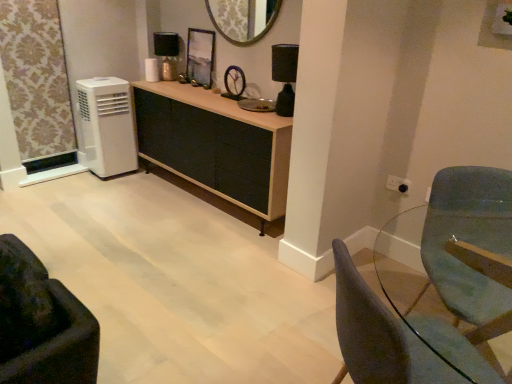
Question: Considering the relative sizes of metallic gold lamp at upper center, positioned as the second lamp in right-to-left order, and black matte lamp at upper right, which is the second lamp from back to front, in the image provided, is metallic gold lamp at upper center, positioned as the second lamp in right-to-left order, thinner than black matte lamp at upper right, which is the second lamp from back to front,?

Choices:
 (A) yes
 (B) no

Answer: (A)

Question: From a real-world perspective, is metallic gold lamp at upper center, the 2th lamp in the front-to-back sequence, physically below black matte lamp at upper right, which is the 2th lamp from left to right?

Choices:
 (A) yes
 (B) no

Answer: (A)

Question: From the image's perspective, is metallic gold lamp at upper center, the first lamp from the back, under black matte lamp at upper right, which is the second lamp from back to front?

Choices:
 (A) no
 (B) yes

Answer: (A)

Question: Is metallic gold lamp at upper center, marked as the first lamp in a left-to-right arrangement, in contact with black matte lamp at upper right, which appears as the 1th lamp when viewed from the right?

Choices:
 (A) yes
 (B) no

Answer: (B)

Question: From the image's perspective, is metallic gold lamp at upper center, the 2th lamp in the front-to-back sequence, located above black matte lamp at upper right, which appears as the 1th lamp when viewed from the right?

Choices:
 (A) yes
 (B) no

Answer: (A)

Question: In terms of size, does metallic gold lamp at upper center, positioned as the second lamp in right-to-left order, appear bigger or smaller than matte gray chair at lower right, the first chair when ordered from right to left?

Choices:
 (A) big
 (B) small

Answer: (B)

Question: Considering the positions of metallic gold lamp at upper center, the 1th lamp when ordered from top to bottom, and matte gray chair at lower right, placed as the second chair when sorted from left to right, in the image, is metallic gold lamp at upper center, the 1th lamp when ordered from top to bottom, wider or thinner than matte gray chair at lower right, placed as the second chair when sorted from left to right,?

Choices:
 (A) wide
 (B) thin

Answer: (B)

Question: Considering their positions, is metallic gold lamp at upper center, the first lamp from the back, located in front of or behind matte gray chair at lower right, the first chair when ordered from right to left?

Choices:
 (A) front
 (B) behind

Answer: (B)

Question: From the image's perspective, relative to matte gray chair at lower right, the first chair when ordered from right to left, is metallic gold lamp at upper center, the 1th lamp when ordered from top to bottom, above or below?

Choices:
 (A) below
 (B) above

Answer: (B)

Question: In the image, is metallic reflective frame at center positioned in front of or behind teal fabric swivel chair at right?

Choices:
 (A) behind
 (B) front

Answer: (A)

Question: Is metallic reflective frame at center inside or outside of teal fabric swivel chair at right?

Choices:
 (A) inside
 (B) outside

Answer: (B)

Question: In the image, is metallic reflective frame at center on the left side or the right side of teal fabric swivel chair at right?

Choices:
 (A) right
 (B) left

Answer: (B)

Question: From their relative heights in the image, would you say metallic reflective frame at center is taller or shorter than teal fabric swivel chair at right?

Choices:
 (A) tall
 (B) short

Answer: (B)

Question: In the image, is metallic reflective frame at center on the left side or the right side of black matte lamp at upper right, which is the 2th lamp from left to right?

Choices:
 (A) right
 (B) left

Answer: (B)

Question: From a real-world perspective, is metallic reflective frame at center positioned above or below black matte lamp at upper right, which is the second lamp from back to front?

Choices:
 (A) above
 (B) below

Answer: (B)